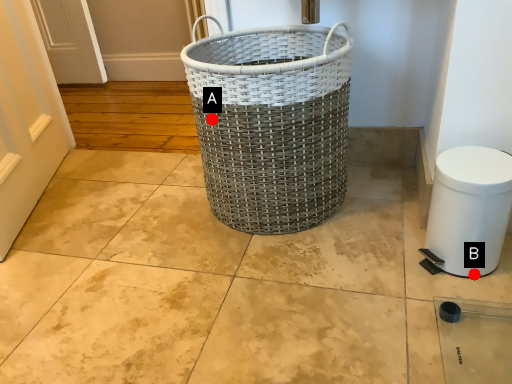
Question: Two points are circled on the image, labeled by A and B beside each circle. Which of the following is the closest to the observer?

Choices:
 (A) A is closer
 (B) B is closer

Answer: (B)